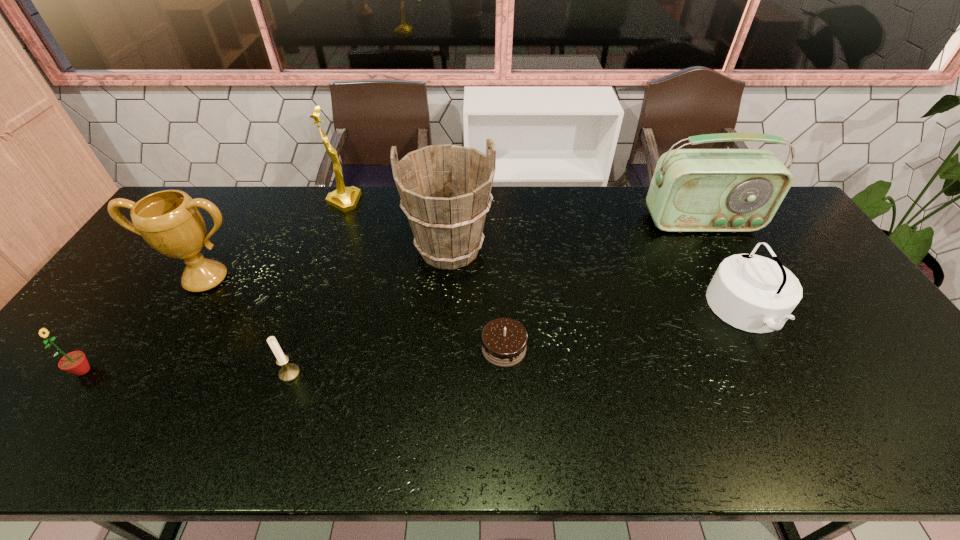
The height and width of the screenshot is (540, 960). I want to click on vacant area that lies between the radio receiver and the shortest object, so click(x=603, y=285).

I want to click on object that stands as the seventh closest to the candle holder, so click(692, 190).

In order to click on object that is the closest to the chocolate cake in this screenshot , I will do `click(445, 190)`.

Locate an element on the screen. free point that satisfies the following two spatial constraints: 1. on the front of the nearer award with the decoration; 2. on the face of the leftmost object is located at coordinates (152, 370).

I want to click on vacant space that satisfies the following two spatial constraints: 1. on the front-facing side of the farther award; 2. on the right side of the bucket, so click(x=326, y=249).

I want to click on free space that satisfies the following two spatial constraints: 1. on the back side of the bucket; 2. on the front-facing side of the farther award, so click(453, 202).

In order to click on vacant space that satisfies the following two spatial constraints: 1. on the back side of the shortest object; 2. on the front-facing side of the right award in this screenshot , I will do `click(497, 202)`.

You are a GUI agent. You are given a task and a screenshot of the screen. Output one action in this format:
    pyautogui.click(x=<x>, y=<y>)
    Task: Click on the blank area in the image that satisfies the following two spatial constraints: 1. on the front of the nearer award with the decoration; 2. on the right side of the candle holder
    Image resolution: width=960 pixels, height=540 pixels.
    Given the screenshot: What is the action you would take?
    pyautogui.click(x=150, y=374)

Locate an element on the screen. This screenshot has height=540, width=960. free point that satisfies the following two spatial constraints: 1. on the front of the left award with the decoration; 2. on the right side of the shortest object is located at coordinates pyautogui.click(x=164, y=348).